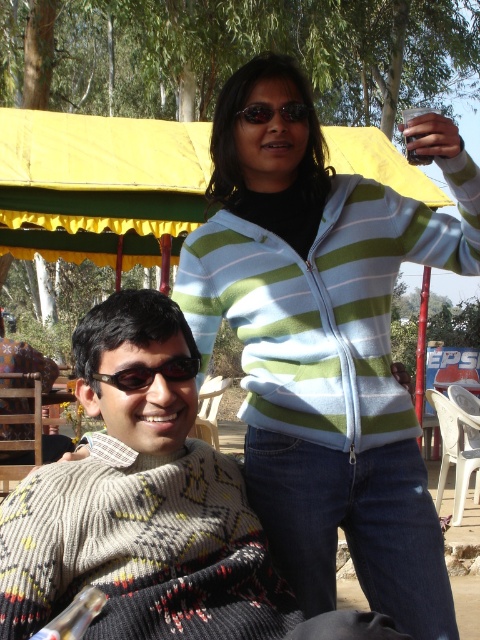
You are planning to pack a backpack for a day trip and need to know the sizes of the striped sweater at upper right and the translucent plastic bottle at lower left. Which item takes up more space?

The striped sweater at upper right is bigger than the translucent plastic bottle at lower left, so it takes up more space.

You are trying to decide which object to grab first. The striped sweater at upper right and the translucent plastic bottle at lower left are both in your line of sight. Which object is wider?

The striped sweater at upper right is wider than the translucent plastic bottle at lower left according to the description.

You are a photographer trying to capture a closeup of the black rubber goggles at left and the sunglasses at upper center. If you want to ensure both items are fully visible in the frame, which object should you adjust your camera focus to prioritize based on their sizes?

The black rubber goggles at left are wider than the sunglasses at upper center. To ensure both are fully visible, prioritize focusing on the black rubber goggles at left since it requires more space in the frame.